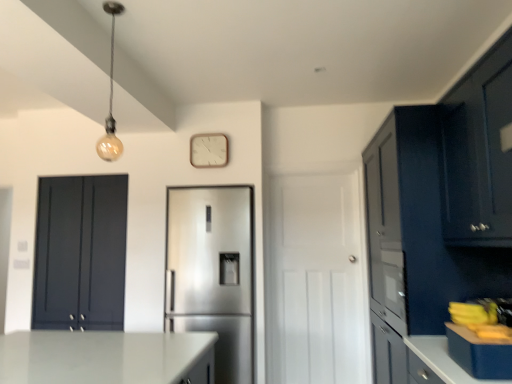
Question: Does point (113, 3) appear closer or farther from the camera than point (122, 292)?

Choices:
 (A) farther
 (B) closer

Answer: (B)

Question: In terms of height, does matte glass bulb at upper left look taller or shorter compared to matte dark blue cabinet at left, which is the third cabinetry from right to left?

Choices:
 (A) tall
 (B) short

Answer: (B)

Question: Estimate the real-world distances between objects in this image. Which object is closer to the matte glass bulb at upper left?

Choices:
 (A) matte dark blue cabinet at right, marked as the second cabinetry in a left-to-right arrangement
 (B) white matte door at center
 (C) matte dark blue cabinet at upper right, positioned as the 3th cabinetry in left-to-right order
 (D) satin silver refrigerator at center
 (E) matte dark blue cabinet at left, which is the third cabinetry from right to left

Answer: (E)

Question: Estimate the real-world distances between objects in this image. Which object is closer to the matte glass bulb at upper left?

Choices:
 (A) white matte door at center
 (B) blue matte countertop at right
 (C) satin silver refrigerator at center
 (D) matte dark blue cabinet at upper right, which is the 1th cabinetry from right to left
 (E) wooden clock at upper center

Answer: (E)